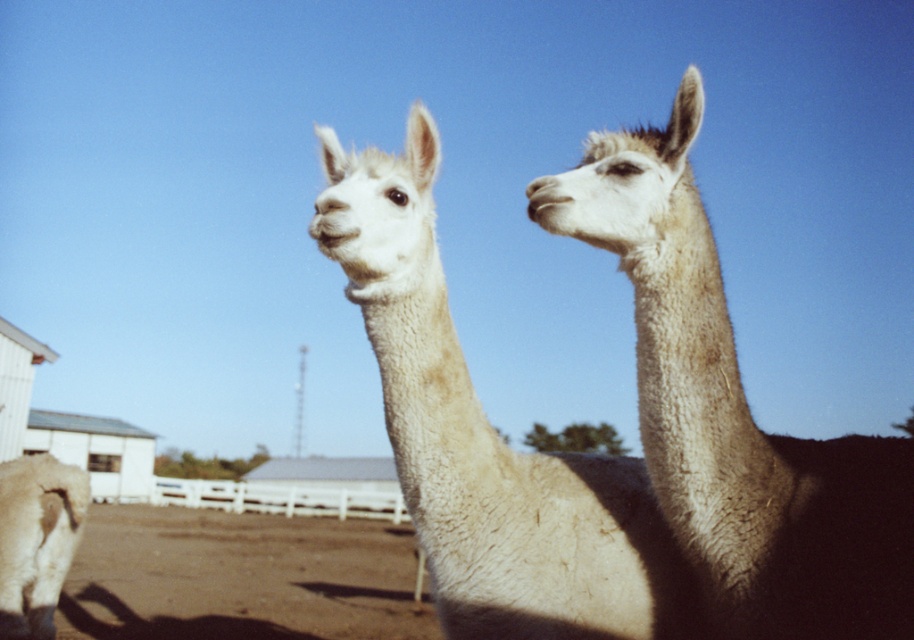
Between white woolen alpaca at upper right and brown dirt field at lower center, which one appears on the right side from the viewer's perspective?

white woolen alpaca at upper right is more to the right.

Does white woolen alpaca at upper right have a greater width compared to brown dirt field at lower center?

No, white woolen alpaca at upper right is not wider than brown dirt field at lower center.

Between point (772, 576) and point (254, 540), which one is positioned behind?

Positioned behind is point (254, 540).

I want to click on white woolen alpaca at upper right, so point(732,413).

Does white woolen alpaca at center have a greater width compared to brown dirt field at lower center?

Incorrect, white woolen alpaca at center's width does not surpass brown dirt field at lower center's.

Does white woolen alpaca at center have a lesser width compared to brown dirt field at lower center?

Indeed, white woolen alpaca at center has a lesser width compared to brown dirt field at lower center.

What are the coordinates of `white woolen alpaca at center` in the screenshot? It's located at (487, 440).

Is point (891, 538) in front of point (433, 284)?

Yes.

In the scene shown: Between white woolen alpaca at upper right and white woolen alpaca at center, which one appears on the left side from the viewer's perspective?

white woolen alpaca at center is more to the left.

Where is `white woolen alpaca at upper right`? The height and width of the screenshot is (640, 914). white woolen alpaca at upper right is located at coordinates (732, 413).